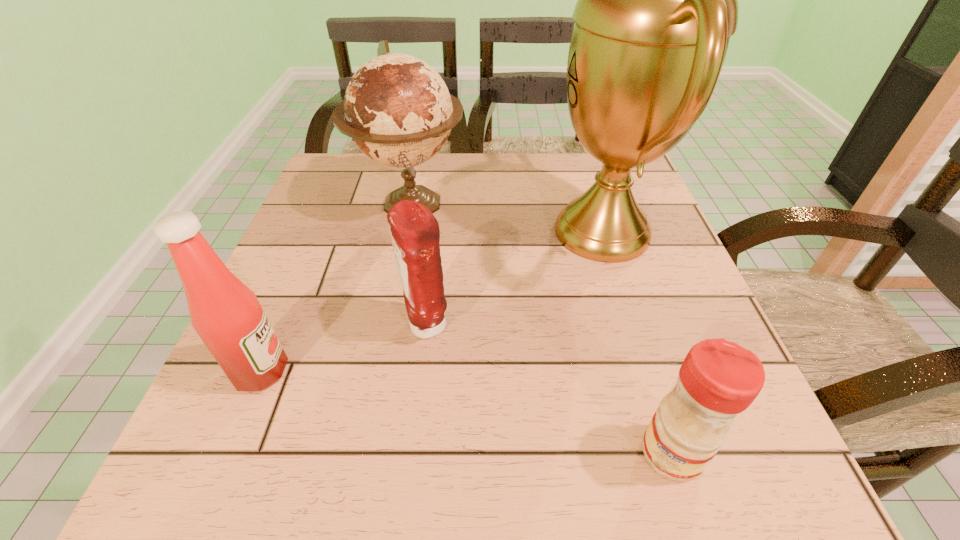
Image resolution: width=960 pixels, height=540 pixels. In order to click on vacant region between the nearest condiment and the second condiment from left to right in this screenshot , I will do `click(549, 390)`.

Identify the location of free area in between the tallest object and the globe. This screenshot has width=960, height=540. (506, 218).

At what (x,y) coordinates should I click in order to perform the action: click on free space between the second condiment from right to left and the leftmost condiment. Please return your answer as a coordinate pair (x, y). This screenshot has width=960, height=540. Looking at the image, I should click on (344, 349).

Image resolution: width=960 pixels, height=540 pixels. I want to click on empty space that is in between the tallest object and the globe, so click(506, 218).

In order to click on free space between the second condiment from right to left and the trophy cup in this screenshot , I will do `click(515, 279)`.

At what (x,y) coordinates should I click in order to perform the action: click on vacant space in between the rightmost condiment and the second condiment from left to right. Please return your answer as a coordinate pair (x, y). Looking at the image, I should click on tap(549, 390).

Select which object appears as the closest to the rightmost condiment. Please provide its 2D coordinates. Your answer should be formatted as a tuple, i.e. [(x, y)], where the tuple contains the x and y coordinates of a point satisfying the conditions above.

[(657, 0)]

Where is `object that stands as the fourth closest to the rightmost condiment`? This screenshot has width=960, height=540. object that stands as the fourth closest to the rightmost condiment is located at coordinates (226, 314).

Select which condiment is the third closest to the trophy cup. Please provide its 2D coordinates. Your answer should be formatted as a tuple, i.e. [(x, y)], where the tuple contains the x and y coordinates of a point satisfying the conditions above.

[(226, 314)]

The height and width of the screenshot is (540, 960). Identify the location of condiment that is the second closest one to the nearest condiment. (226, 314).